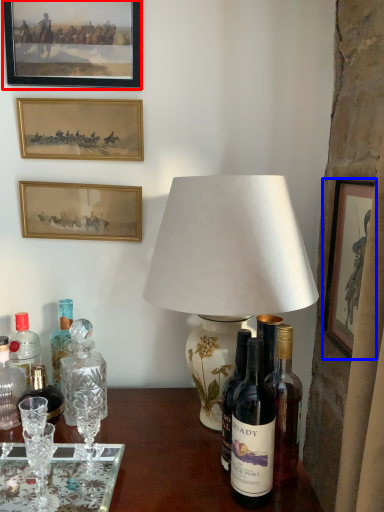
Question: Which object appears closest to the camera in this image, picture frame (highlighted by a red box) or picture frame (highlighted by a blue box)?

Choices:
 (A) picture frame
 (B) picture frame

Answer: (B)